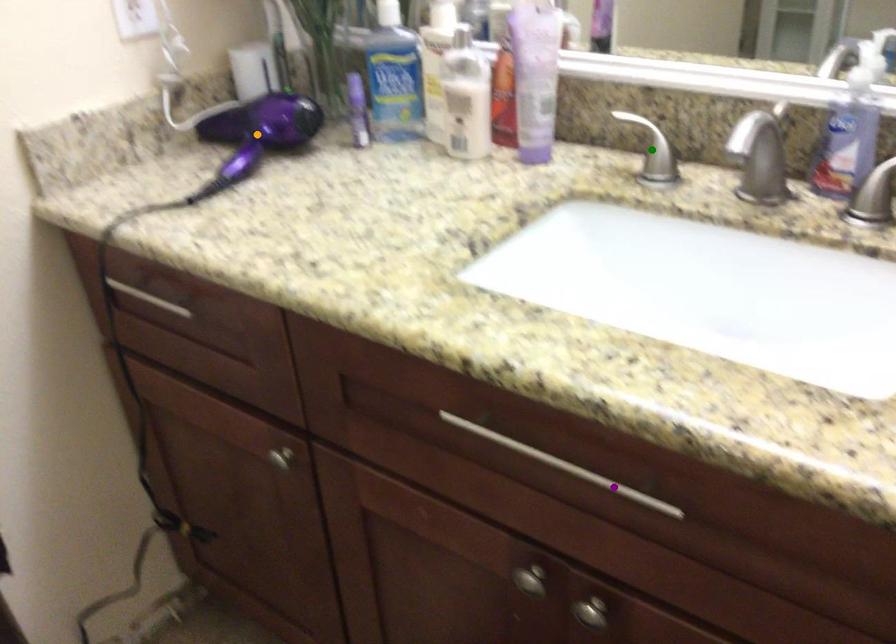
Order these from farthest to nearest:
purple point | orange point | green point

orange point, green point, purple point